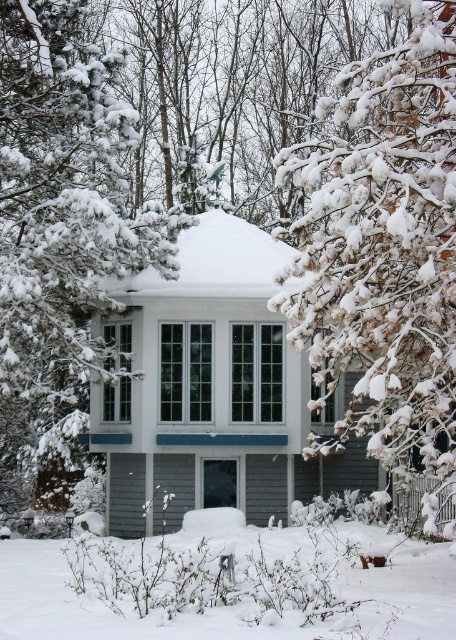
Question: Is snow-covered branches at upper right bigger than white fluffy snow at lower center?

Choices:
 (A) no
 (B) yes

Answer: (B)

Question: Which object appears farthest from the camera in this image?

Choices:
 (A) snow-covered pine tree at center
 (B) snow-covered branches at upper right
 (C) white fluffy snow at lower center
 (D) white matte gazebo at center

Answer: (D)

Question: Can you confirm if white matte gazebo at center is bigger than snow-covered pine tree at center?

Choices:
 (A) no
 (B) yes

Answer: (A)

Question: Which point is closer to the camera?

Choices:
 (A) (160, 362)
 (B) (62, 109)

Answer: (B)

Question: Among these objects, which one is farthest from the camera?

Choices:
 (A) snow-covered branches at upper right
 (B) snow-covered pine tree at center

Answer: (B)

Question: From the image, what is the correct spatial relationship of white matte gazebo at center in relation to white fluffy snow at lower center?

Choices:
 (A) above
 (B) below

Answer: (A)